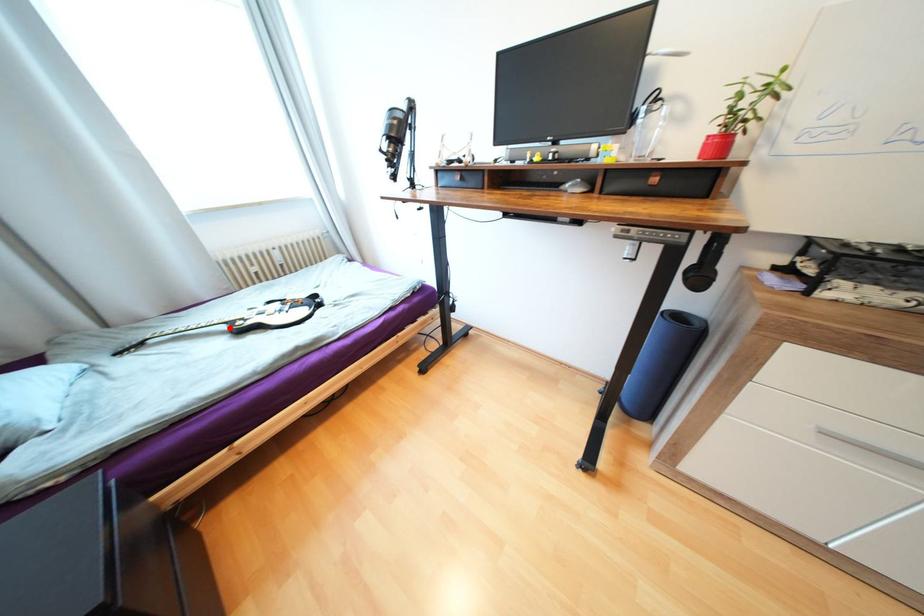
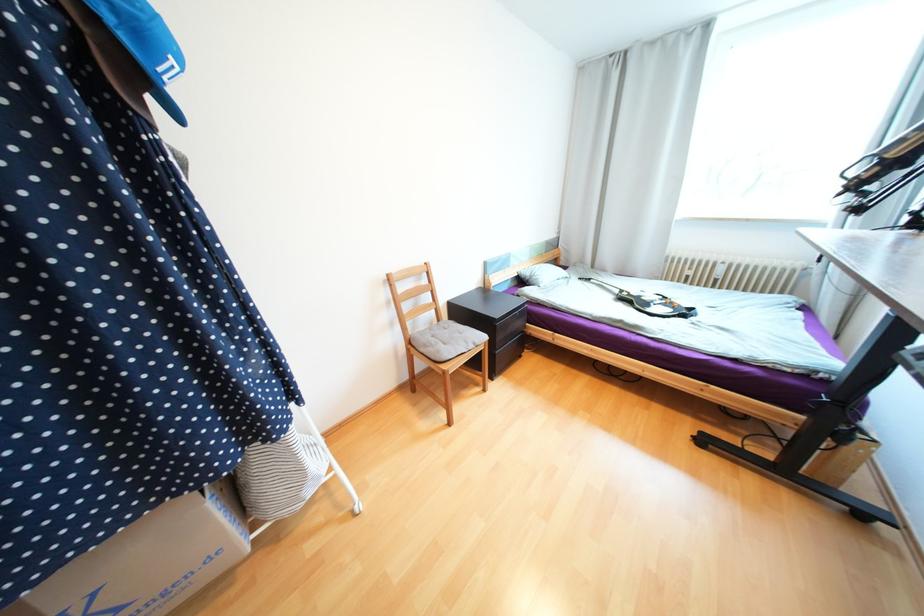
Where in the second image is the point corresponding to the highlighted location from the first image?

(623, 292)